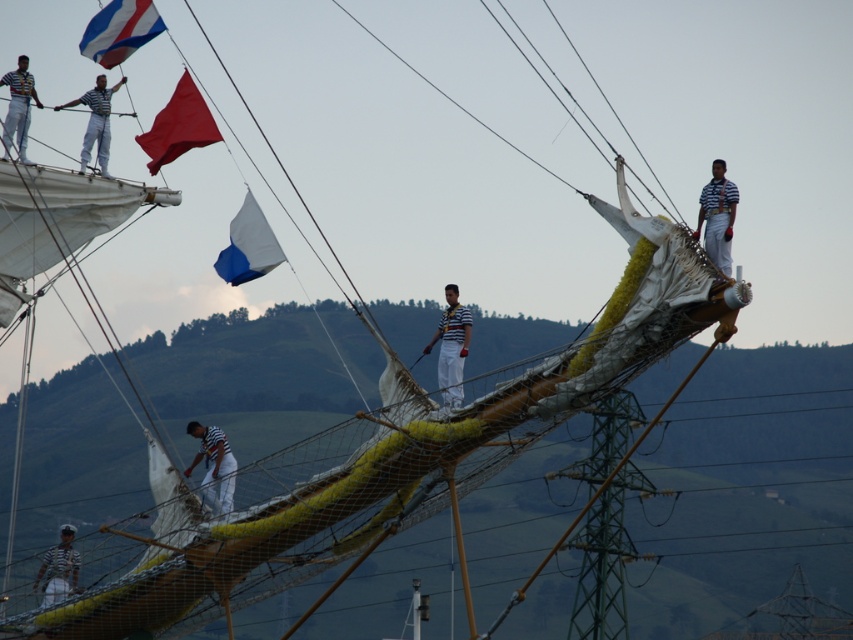
Question: Which of the following is the farthest from the observer?

Choices:
 (A) (730, 216)
 (B) (213, 140)
 (C) (86, 44)

Answer: (C)

Question: Does blue matte flag at center come in front of white striped shirt at upper right?

Choices:
 (A) yes
 (B) no

Answer: (B)

Question: Can you confirm if striped fabric sailor at center is bigger than striped shirt and pants at upper left?

Choices:
 (A) no
 (B) yes

Answer: (B)

Question: Does blue and white striped fabric at upper left appear over blue matte flag at center?

Choices:
 (A) no
 (B) yes

Answer: (B)

Question: Estimate the real-world distances between objects in this image. Which object is closer to the red fabric flag at upper center?

Choices:
 (A) striped shirt and pants at upper left
 (B) white striped shirt at upper right

Answer: (A)

Question: Which object appears farthest from the camera in this image?

Choices:
 (A) white striped shirt at center
 (B) striped shirt sailor at upper left

Answer: (B)